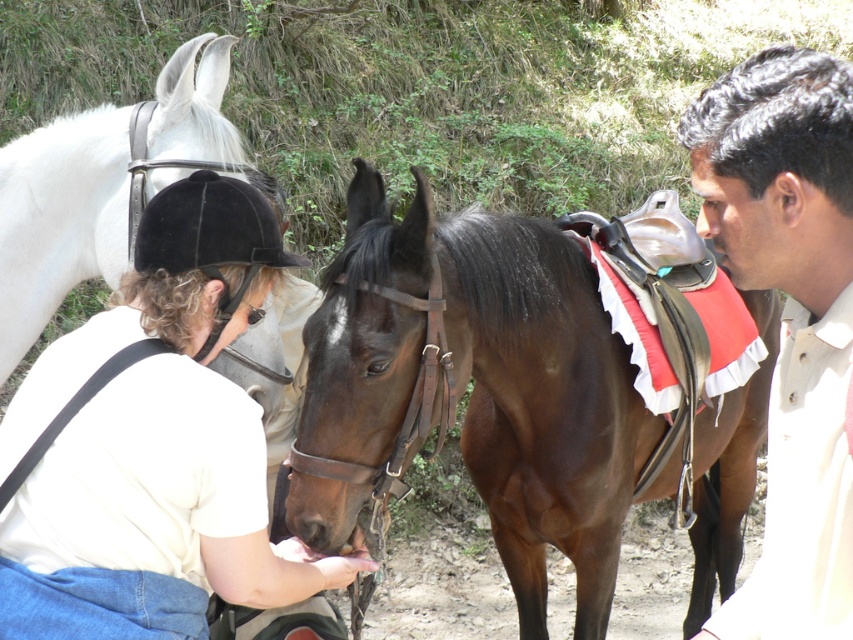
Question: Among these points, which one is farthest from the camera?

Choices:
 (A) (463, 448)
 (B) (15, 508)
 (C) (103, 204)

Answer: (A)

Question: Which of the following is the closest to the observer?

Choices:
 (A) smooth beige shirt at right
 (B) white leather bridle at upper left
 (C) brown leather horse at center
 (D) white matte helmet at upper left

Answer: (A)

Question: Which of the following is the closest to the observer?

Choices:
 (A) smooth beige shirt at right
 (B) brown leather horse at center

Answer: (A)

Question: Is brown leather horse at center closer to the viewer compared to smooth beige shirt at right?

Choices:
 (A) yes
 (B) no

Answer: (B)

Question: Can you confirm if brown leather horse at center is smaller than smooth beige shirt at right?

Choices:
 (A) yes
 (B) no

Answer: (B)

Question: Is white matte helmet at upper left positioned at the back of white leather bridle at upper left?

Choices:
 (A) yes
 (B) no

Answer: (B)